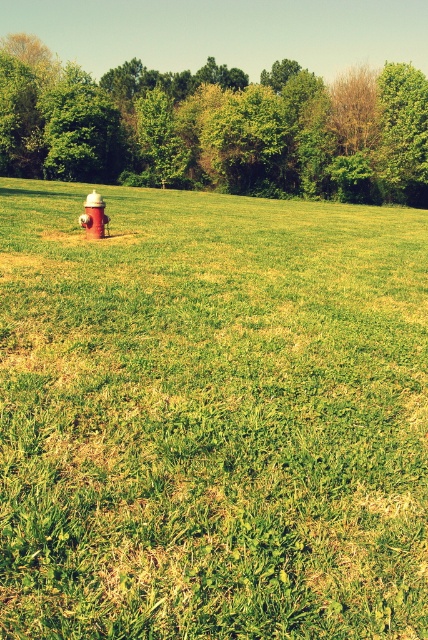
Can you confirm if green grassy field at center is positioned above green leafy tree at upper center?

Actually, green grassy field at center is below green leafy tree at upper center.

This screenshot has height=640, width=428. What are the coordinates of `green grassy field at center` in the screenshot? It's located at (211, 417).

The height and width of the screenshot is (640, 428). Find the location of `green grassy field at center`. green grassy field at center is located at coordinates (211, 417).

Consider the image. Which of these two, green grassy field at center or red painted hydrant at center, stands taller?

Standing taller between the two is green grassy field at center.

Can you confirm if green grassy field at center is taller than red painted hydrant at center?

Yes.

Does point (362, 458) come behind point (88, 204)?

That is False.

What are the coordinates of `green grassy field at center` in the screenshot? It's located at (211, 417).

Is point (137, 140) behind point (100, 200)?

Yes.

Who is shorter, green leafy tree at upper center or red painted hydrant at center?

With less height is red painted hydrant at center.

The width and height of the screenshot is (428, 640). In order to click on green leafy tree at upper center in this screenshot , I will do `click(216, 128)`.